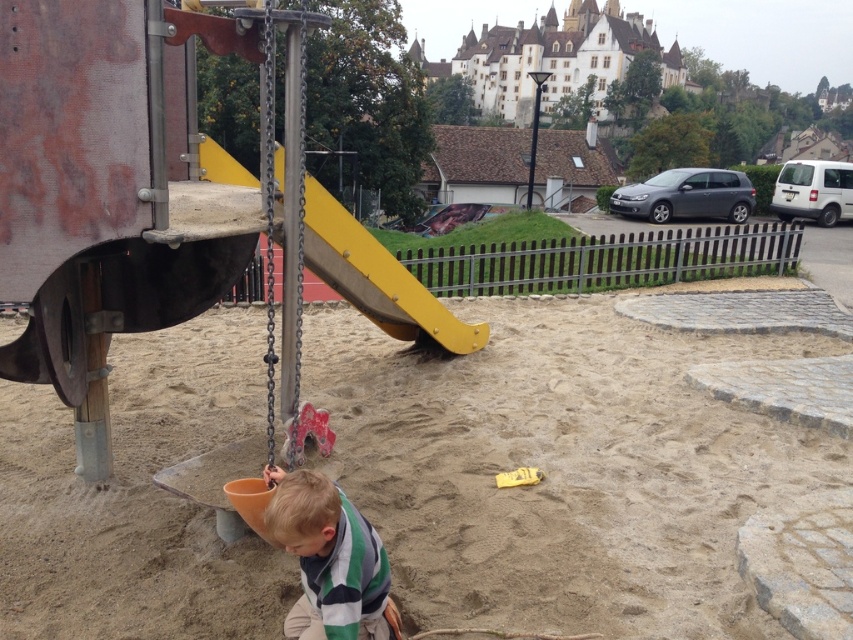
Can you confirm if green striped shirt at center is thinner than yellow matte slide at center?

Incorrect, green striped shirt at center's width is not less than yellow matte slide at center's.

Does point (320, 481) come farther from viewer compared to point (341, 212)?

No, (320, 481) is in front of (341, 212).

What are the coordinates of `green striped shirt at center` in the screenshot? It's located at (329, 560).

Does fine-grained sand at center have a lesser height compared to green striped shirt at center?

Correct, fine-grained sand at center is not as tall as green striped shirt at center.

Is fine-grained sand at center positioned behind green striped shirt at center?

Yes, fine-grained sand at center is behind green striped shirt at center.

Which is behind, point (595, 452) or point (334, 598)?

Point (595, 452)

Locate an element on the screen. The height and width of the screenshot is (640, 853). fine-grained sand at center is located at coordinates (563, 467).

How much distance is there between fine-grained sand at center and yellow matte slide at center?

A distance of 8.27 feet exists between fine-grained sand at center and yellow matte slide at center.

Between point (45, 506) and point (206, 148), which one is positioned behind?

The point (206, 148) is behind.

Where is `fine-grained sand at center`? Image resolution: width=853 pixels, height=640 pixels. fine-grained sand at center is located at coordinates (563, 467).